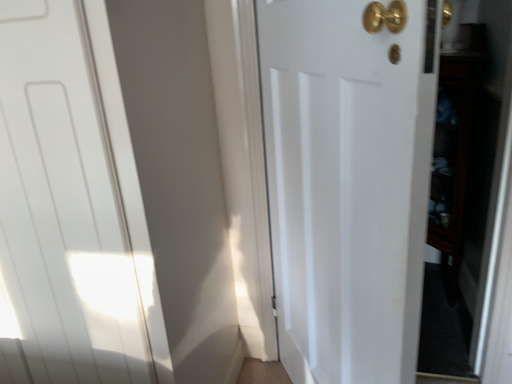
Question: Can you confirm if white matte door at center, which ranks as the 2th door in left-to-right order, is positioned to the left of dark wood cabinet at right?

Choices:
 (A) no
 (B) yes

Answer: (B)

Question: Is white matte door at center, which ranks as the 2th door in left-to-right order, surrounding dark wood cabinet at right?

Choices:
 (A) yes
 (B) no

Answer: (B)

Question: Does white matte door at center, the 1th door from the right, have a lesser height compared to dark wood cabinet at right?

Choices:
 (A) yes
 (B) no

Answer: (B)

Question: From the image's perspective, is white matte door at center, the 1th door from the right, under dark wood cabinet at right?

Choices:
 (A) yes
 (B) no

Answer: (A)

Question: Are white matte door at center, the 1th door from the right, and dark wood cabinet at right making contact?

Choices:
 (A) yes
 (B) no

Answer: (B)

Question: Is white matte door at center, the 1th door from the right, not close to dark wood cabinet at right?

Choices:
 (A) yes
 (B) no

Answer: (B)

Question: From a real-world perspective, is white matte door at center, the 1th door from the right, physically above white matte door at left, which is the first door from left to right?

Choices:
 (A) no
 (B) yes

Answer: (A)

Question: Is white matte door at center, which ranks as the 2th door in left-to-right order, to the left of white matte door at left, which appears as the 2th door when viewed from the right, from the viewer's perspective?

Choices:
 (A) yes
 (B) no

Answer: (B)

Question: Is white matte door at center, which ranks as the 2th door in left-to-right order, not inside white matte door at left, which is the first door from left to right?

Choices:
 (A) yes
 (B) no

Answer: (A)

Question: Does white matte door at center, which ranks as the 2th door in left-to-right order, have a greater height compared to white matte door at left, which appears as the 2th door when viewed from the right?

Choices:
 (A) yes
 (B) no

Answer: (B)

Question: Does white matte door at center, the 1th door from the right, have a lesser width compared to white matte door at left, which is the first door from left to right?

Choices:
 (A) yes
 (B) no

Answer: (A)

Question: From a real-world perspective, is dark wood cabinet at right under white matte door at center, the 1th door from the right?

Choices:
 (A) yes
 (B) no

Answer: (A)